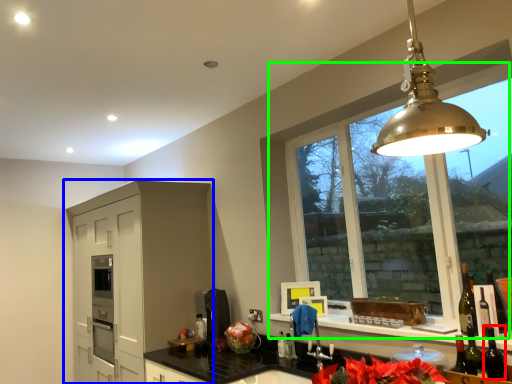
Question: Which is farther away from wine bottle (highlighted by a red box)? cabinetry (highlighted by a blue box) or window (highlighted by a green box)?

Choices:
 (A) cabinetry
 (B) window

Answer: (A)